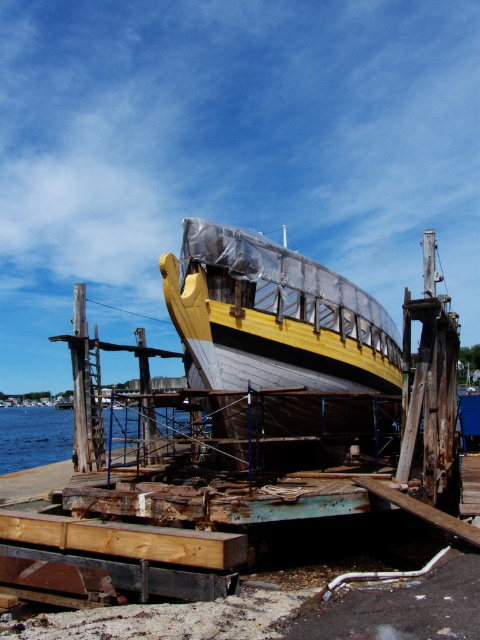
Question: Which object is farther from the camera taking this photo?

Choices:
 (A) yellow wooden boat at center
 (B) blue water at lower left

Answer: (B)

Question: Is yellow wooden boat at center to the left of blue water at lower left from the viewer's perspective?

Choices:
 (A) no
 (B) yes

Answer: (A)

Question: Can you confirm if yellow wooden boat at center is positioned below blue water at lower left?

Choices:
 (A) no
 (B) yes

Answer: (A)

Question: Which object appears farthest from the camera in this image?

Choices:
 (A) blue water at lower left
 (B) yellow wooden boat at center

Answer: (A)

Question: Is yellow wooden boat at center behind blue water at lower left?

Choices:
 (A) no
 (B) yes

Answer: (A)

Question: Which of the following is the farthest from the observer?

Choices:
 (A) (47, 426)
 (B) (196, 362)

Answer: (A)